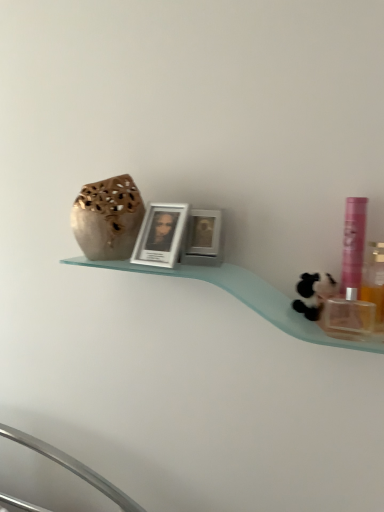
Question: Considering the relative sizes of metallic silver picture frame at center, the 2th picture frame when ordered from left to right, and pink plastic mouthwash at right, which is counted as the second mouthwash, starting from the right, in the image provided, is metallic silver picture frame at center, the 2th picture frame when ordered from left to right, smaller than pink plastic mouthwash at right, which is counted as the second mouthwash, starting from the right,?

Choices:
 (A) yes
 (B) no

Answer: (B)

Question: From the image's perspective, is metallic silver picture frame at center, the 2th picture frame when ordered from left to right, located beneath pink plastic mouthwash at right, which is counted as the second mouthwash, starting from the right?

Choices:
 (A) yes
 (B) no

Answer: (B)

Question: Does metallic silver picture frame at center, the 2th picture frame when ordered from left to right, appear on the left side of pink plastic mouthwash at right, arranged as the first mouthwash when viewed from the left?

Choices:
 (A) no
 (B) yes

Answer: (B)

Question: From the image's perspective, is metallic silver picture frame at center, the 2th picture frame when ordered from left to right, on top of pink plastic mouthwash at right, which is counted as the second mouthwash, starting from the right?

Choices:
 (A) yes
 (B) no

Answer: (A)

Question: From a real-world perspective, is metallic silver picture frame at center, arranged as the first picture frame when viewed from the right, positioned over pink plastic mouthwash at right, arranged as the first mouthwash when viewed from the left, based on gravity?

Choices:
 (A) no
 (B) yes

Answer: (B)

Question: From the image's perspective, is pink plastic mouthwash at right, arranged as the first mouthwash when viewed from the left, located above or below white glossy picture frame at center, acting as the first picture frame starting from the left?

Choices:
 (A) below
 (B) above

Answer: (A)

Question: From a real-world perspective, is pink plastic mouthwash at right, arranged as the first mouthwash when viewed from the left, above or below white glossy picture frame at center, which is the 2th picture frame from right to left?

Choices:
 (A) above
 (B) below

Answer: (B)

Question: In terms of height, does pink plastic mouthwash at right, arranged as the first mouthwash when viewed from the left, look taller or shorter compared to white glossy picture frame at center, which is the 2th picture frame from right to left?

Choices:
 (A) tall
 (B) short

Answer: (A)

Question: Is pink plastic mouthwash at right, arranged as the first mouthwash when viewed from the left, to the left or to the right of white glossy picture frame at center, which is the 2th picture frame from right to left, in the image?

Choices:
 (A) right
 (B) left

Answer: (A)

Question: Visually, is pink plastic mouthwash at right, arranged as the first mouthwash when viewed from the left, positioned to the left or to the right of black plush toy at right?

Choices:
 (A) left
 (B) right

Answer: (B)

Question: Relative to black plush toy at right, is pink plastic mouthwash at right, which is counted as the second mouthwash, starting from the right, in front or behind?

Choices:
 (A) behind
 (B) front

Answer: (B)

Question: Based on their sizes in the image, would you say pink plastic mouthwash at right, arranged as the first mouthwash when viewed from the left, is bigger or smaller than black plush toy at right?

Choices:
 (A) big
 (B) small

Answer: (B)

Question: Is point (355, 202) positioned closer to the camera than point (306, 304)?

Choices:
 (A) farther
 (B) closer

Answer: (A)

Question: From the image's perspective, is matte beige vase at upper left positioned above or below black plush toy at right?

Choices:
 (A) below
 (B) above

Answer: (B)

Question: Is matte beige vase at upper left to the left or to the right of black plush toy at right in the image?

Choices:
 (A) left
 (B) right

Answer: (A)